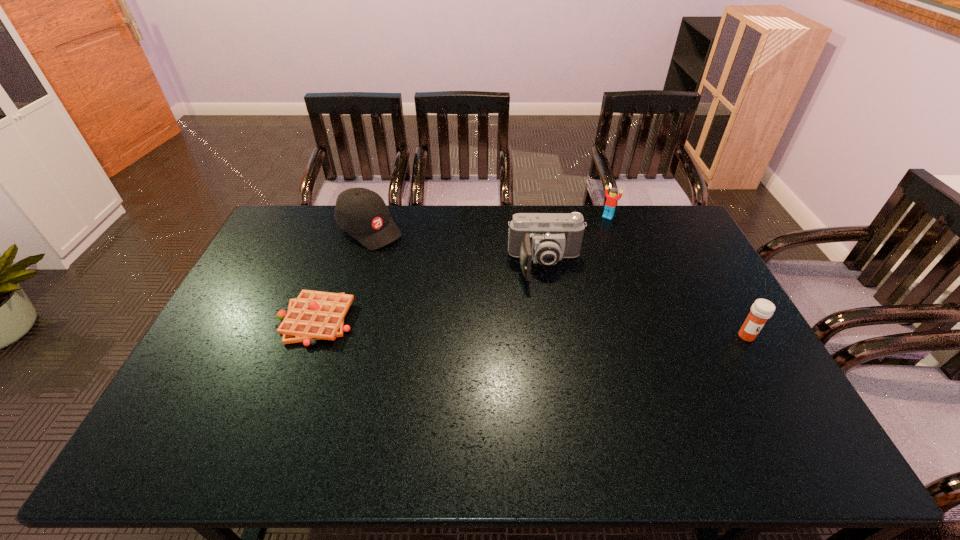
This screenshot has height=540, width=960. I want to click on vacant space on the desktop that is between the waffle and the medicine and is positioned on the face of the fourth object from left to right, so click(538, 328).

What are the coordinates of `free space on the desktop that is between the shortest object and the rightmost object and is positioned with a logo on the front of the baseball cap` in the screenshot? It's located at (499, 327).

I want to click on free space on the desktop that is between the shortest object and the medicine and is positioned at the front of the third object from right to left with an open lens cover, so click(x=555, y=329).